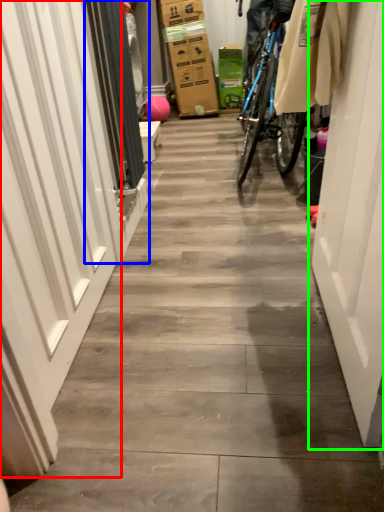
Question: Which object is positioned closest to garage door (highlighted by a red box)? Select from screen door (highlighted by a blue box) and door (highlighted by a green box).

Choices:
 (A) screen door
 (B) door

Answer: (A)